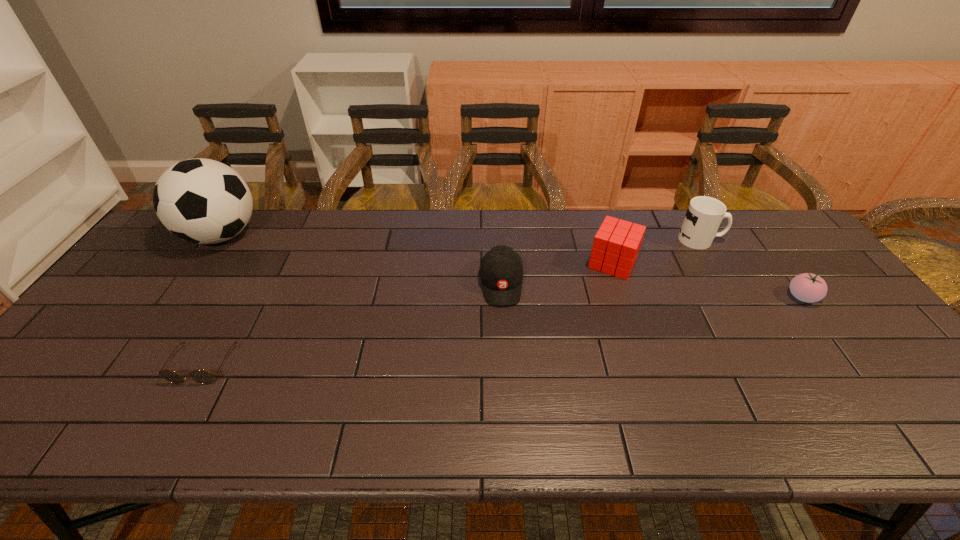
Identify the location of free location located 0.230m on the handle side of the mug. The width and height of the screenshot is (960, 540). (794, 239).

The width and height of the screenshot is (960, 540). I want to click on vacant space situated 0.100m on the back of the fourth object from left to right, so click(601, 227).

You are a GUI agent. You are given a task and a screenshot of the screen. Output one action in this format:
    pyautogui.click(x=<x>, y=<y>)
    Task: Click on the free location located 0.200m with a logo on the front of the baseball cap
    The width and height of the screenshot is (960, 540).
    Given the screenshot: What is the action you would take?
    pyautogui.click(x=506, y=370)

The height and width of the screenshot is (540, 960). I want to click on free region located on the back of the tomato, so click(x=743, y=218).

Identify the location of free space located 0.050m on the lenses of the nearest object. (180, 405).

Locate an element on the screen. The image size is (960, 540). soccer ball positioned at the far edge is located at coordinates (203, 201).

The image size is (960, 540). I want to click on mug present at the far edge, so click(x=704, y=215).

Locate an element on the screen. The image size is (960, 540). cube present at the far edge is located at coordinates (616, 245).

Where is `object that is at the left edge`? Image resolution: width=960 pixels, height=540 pixels. object that is at the left edge is located at coordinates (203, 201).

Where is `object that is at the right edge`? object that is at the right edge is located at coordinates (807, 287).